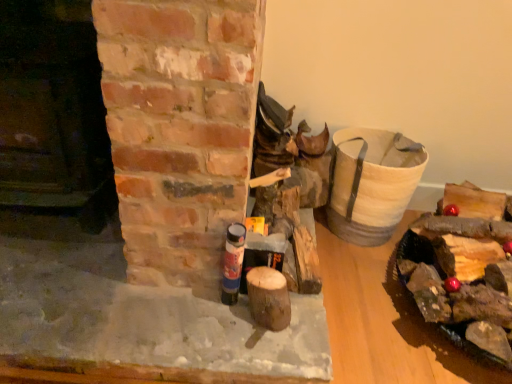
I want to click on vacant space situated on the left part of blue matte spray can at center, so click(x=180, y=312).